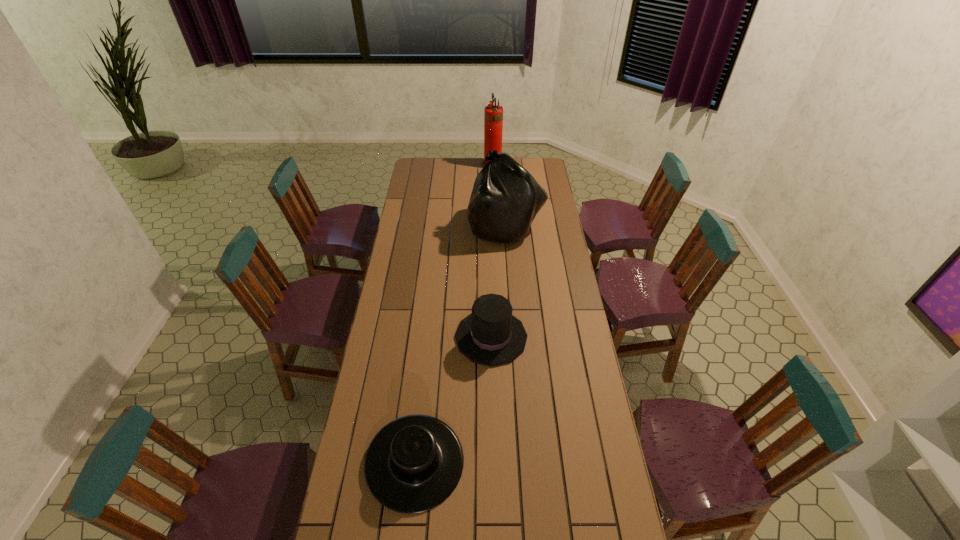
Identify the location of free point between the fire extinguisher and the third tallest object. (492, 251).

Find the location of a particular element. The width and height of the screenshot is (960, 540). free space between the farther dress hat and the plastic bag is located at coordinates (498, 281).

The width and height of the screenshot is (960, 540). I want to click on unoccupied position between the farthest object and the farther dress hat, so click(x=492, y=251).

Choose which object is the second nearest neighbor to the shortest object. Please provide its 2D coordinates. Your answer should be formatted as a tuple, i.e. [(x, y)], where the tuple contains the x and y coordinates of a point satisfying the conditions above.

[(505, 199)]

Where is `object that is the closest to the taller dress hat`? The width and height of the screenshot is (960, 540). object that is the closest to the taller dress hat is located at coordinates (413, 464).

Image resolution: width=960 pixels, height=540 pixels. I want to click on blank area in the image that satisfies the following two spatial constraints: 1. on the front side of the plastic bag; 2. on the front of the third tallest object with the decoration, so click(x=514, y=337).

Identify the location of free spot that satisfies the following two spatial constraints: 1. at the discharge end of the farthest object; 2. on the right side of the second farthest object. (495, 226).